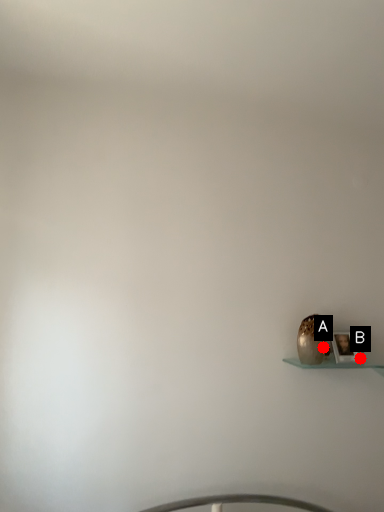
Question: Two points are circled on the image, labeled by A and B beside each circle. Which point is closer to the camera?

Choices:
 (A) A is closer
 (B) B is closer

Answer: (A)